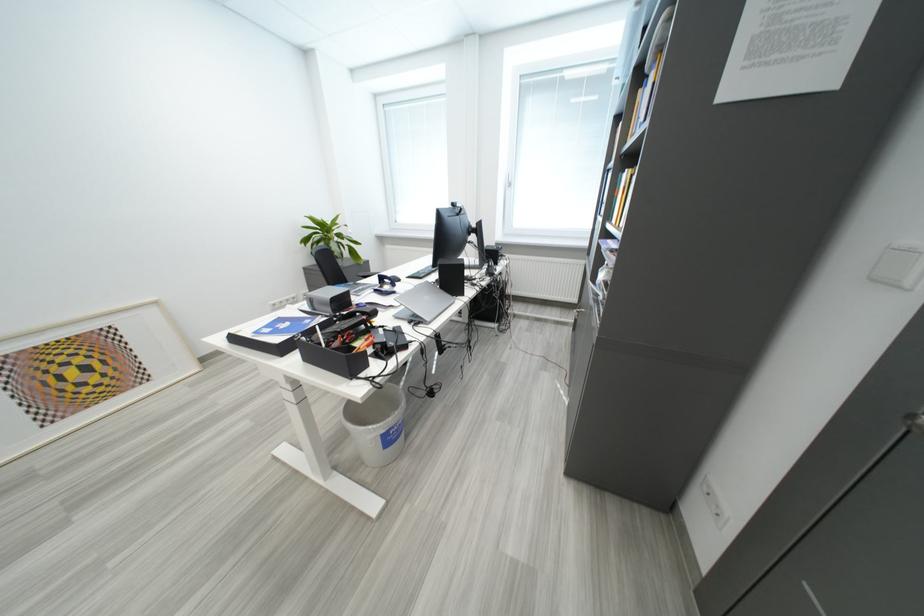
Where is `grey laptop computer`? The height and width of the screenshot is (616, 924). grey laptop computer is located at coordinates (422, 302).